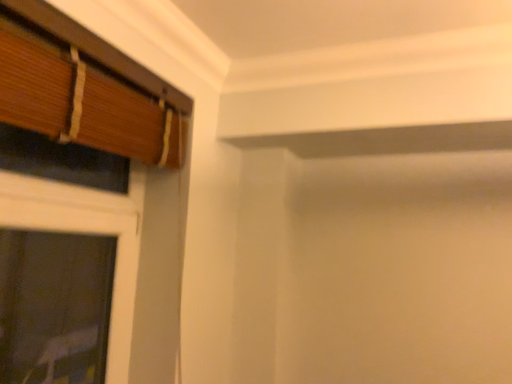
Question: Is point (109, 120) closer or farther from the camera than point (122, 294)?

Choices:
 (A) farther
 (B) closer

Answer: (B)

Question: From the image's perspective, is wooden blinds at left, the first window in the right-to-left sequence, located above or below wooden blinds at left, the 1th window positioned from the left?

Choices:
 (A) above
 (B) below

Answer: (A)

Question: Considering their positions, is wooden blinds at left, the first window in the right-to-left sequence, located in front of or behind wooden blinds at left, the 1th window positioned from the left?

Choices:
 (A) behind
 (B) front

Answer: (B)

Question: Is point (2, 150) positioned closer to the camera than point (66, 62)?

Choices:
 (A) farther
 (B) closer

Answer: (A)

Question: Is wooden blinds at left, the 1th window positioned from the left, inside or outside of wooden blinds at left, the first window in the right-to-left sequence?

Choices:
 (A) outside
 (B) inside

Answer: (A)

Question: From the image's perspective, is wooden blinds at left, which is the 2th window from right to left, located above or below wooden blinds at left, the first window in the right-to-left sequence?

Choices:
 (A) above
 (B) below

Answer: (B)

Question: Considering their positions, is wooden blinds at left, which is the 2th window from right to left, located in front of or behind wooden blinds at left, the first window in the right-to-left sequence?

Choices:
 (A) front
 (B) behind

Answer: (B)